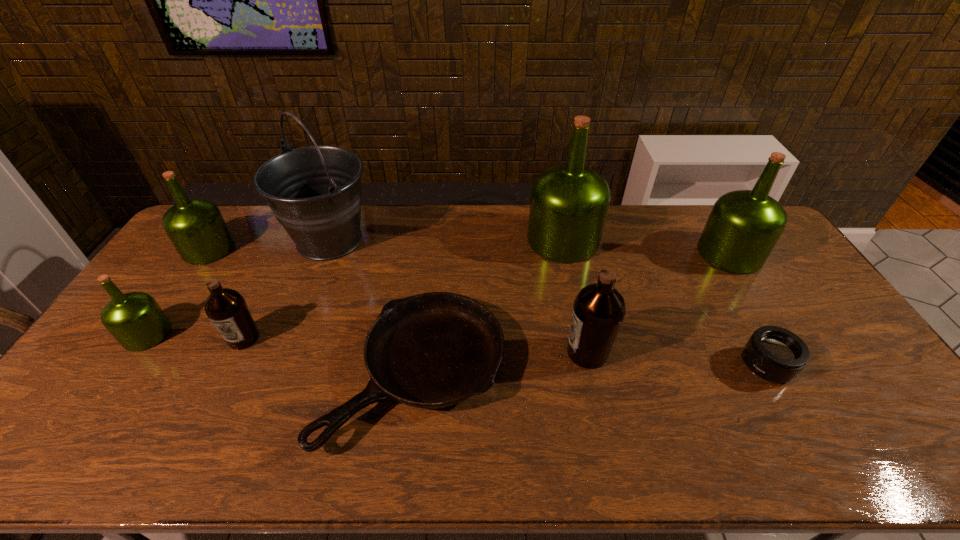
Identify the location of bucket. tap(315, 193).

The image size is (960, 540). In order to click on the tallest olive oil in this screenshot , I will do click(x=569, y=203).

At what (x,y) coordinates should I click in order to perform the action: click on the biggest green olive oil. Please return your answer as a coordinate pair (x, y). The height and width of the screenshot is (540, 960). Looking at the image, I should click on (569, 203).

Find the location of a particular element. The image size is (960, 540). the second biggest green olive oil is located at coordinates (743, 227).

At what (x,y) coordinates should I click in order to perform the action: click on the rightmost olive oil. Please return your answer as a coordinate pair (x, y). The height and width of the screenshot is (540, 960). Looking at the image, I should click on (743, 227).

Image resolution: width=960 pixels, height=540 pixels. What are the coordinates of `the third biggest green olive oil` in the screenshot? It's located at (196, 227).

Locate an element on the screen. the right brown olive oil is located at coordinates (599, 309).

At what (x,y) coordinates should I click in order to perform the action: click on the left brown olive oil. Please return your answer as a coordinate pair (x, y). This screenshot has width=960, height=540. Looking at the image, I should click on (226, 308).

Locate an element on the screen. This screenshot has width=960, height=540. the fourth olive oil from right to left is located at coordinates (226, 308).

Image resolution: width=960 pixels, height=540 pixels. I want to click on the nearest green olive oil, so click(x=135, y=319).